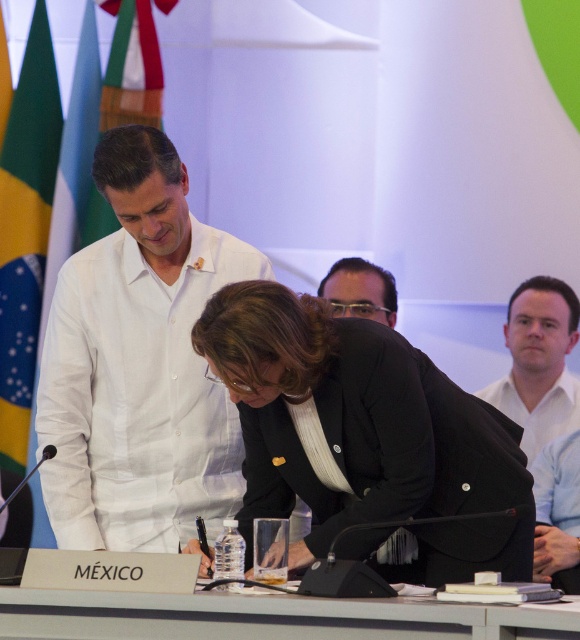
Question: Is black matte blazer at center further to the viewer compared to green fabric flag at left?

Choices:
 (A) yes
 (B) no

Answer: (B)

Question: Based on their relative distances, which object is nearer to the black matte blazer at center?

Choices:
 (A) white shirt at right
 (B) green fabric flag at left
 (C) brown hair at center
 (D) white plastic table at center

Answer: (D)

Question: Which object is positioned farthest from the white shirt at right?

Choices:
 (A) black matte blazer at center
 (B) white linen shirt at center

Answer: (B)

Question: Is green fabric flag at left closer to the viewer compared to white shirt at right?

Choices:
 (A) yes
 (B) no

Answer: (B)

Question: Considering the real-world distances, which object is closest to the green fabric flag at left?

Choices:
 (A) white linen shirt at center
 (B) black matte blazer at center
 (C) brown hair at center
 (D) white shirt at right

Answer: (A)

Question: Is black matte blazer at center smaller than green fabric flag at left?

Choices:
 (A) no
 (B) yes

Answer: (A)